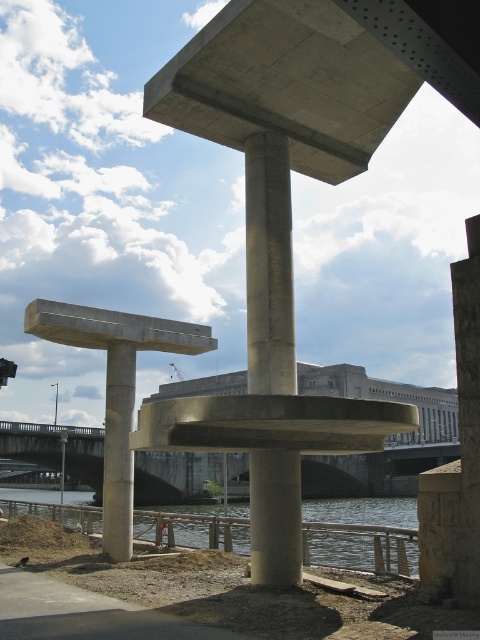
You are standing at the center of the image and want to place a small statue exactly at the concrete at center. What are the coordinates where you should place it?

The coordinates for the concrete at center are at point (268, 266), so you should place the statue there.

You are standing in front of the architectural structure and want to determine the relative positions of two points marked on the structure. Which point, point (319, 563) or point (119, 353), is closer to you?

Point (319, 563) is closer to the viewer than point (119, 353).